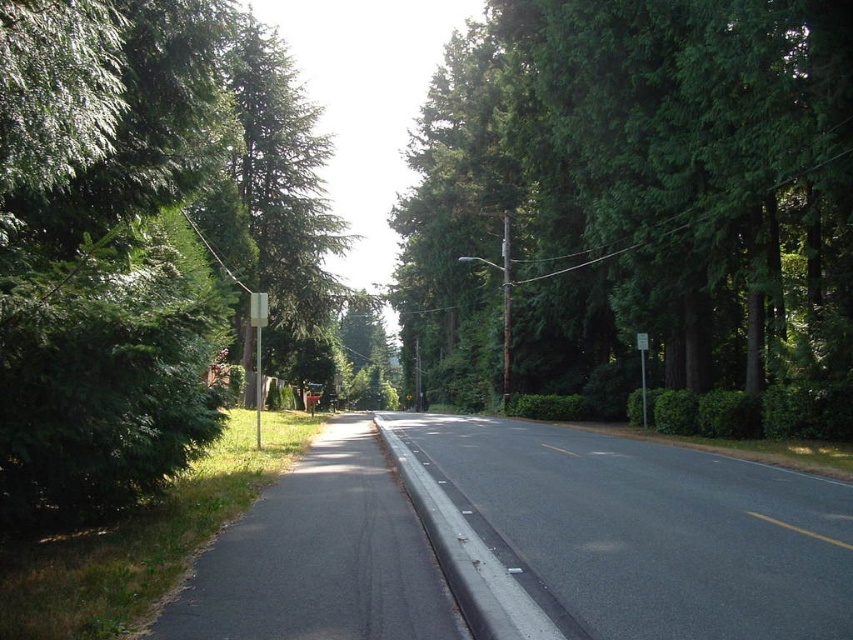
Can you confirm if green leafy tree at center is wider than green matte tree at left?

In fact, green leafy tree at center might be narrower than green matte tree at left.

Is point (419, 163) behind point (294, 364)?

No, it is in front of (294, 364).

At what (x,y) coordinates should I click in order to perform the action: click on green leafy tree at center. Please return your answer as a coordinate pair (x, y). Image resolution: width=853 pixels, height=640 pixels. Looking at the image, I should click on (633, 198).

Which is below, green leafy tree at center or white plastic sign at center?

white plastic sign at center is below.

Does point (415, 260) come closer to viewer compared to point (260, 408)?

No, it is not.

From the picture: Who is more forward, (573,316) or (254,385)?

Point (573,316) is in front.

Where is `green leafy tree at center`? This screenshot has height=640, width=853. green leafy tree at center is located at coordinates (633, 198).

Measure the distance between green matte tree at left and white plastic street sign at center.

A distance of 27.45 meters exists between green matte tree at left and white plastic street sign at center.

Can you confirm if green matte tree at left is wider than white plastic street sign at center?

Indeed, green matte tree at left has a greater width compared to white plastic street sign at center.

In the scene shown: Who is more forward, (293,323) or (637,333)?

Point (637,333)

The height and width of the screenshot is (640, 853). I want to click on green matte tree at left, so click(285, 198).